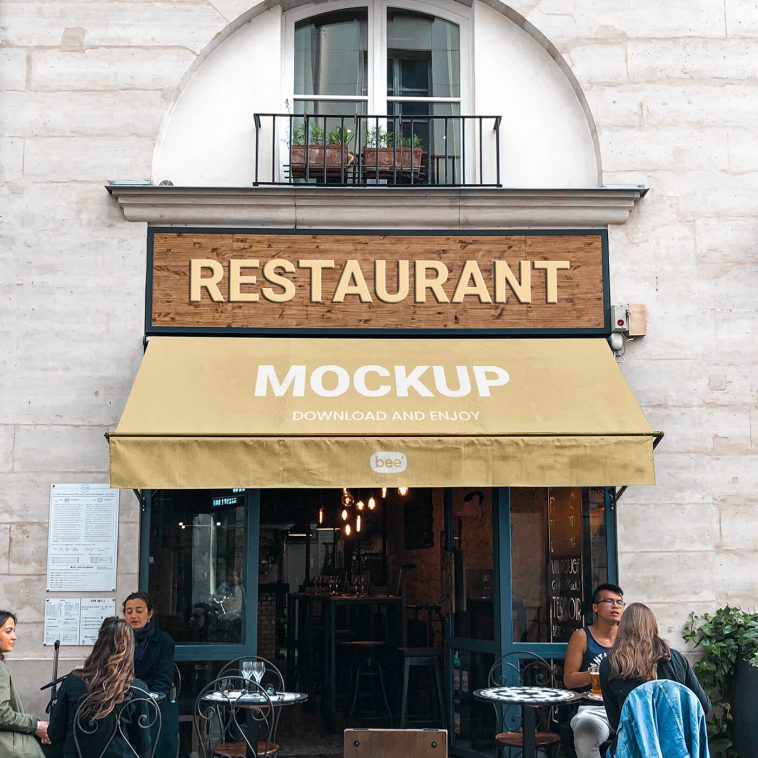
Identify the location of tables. (282, 694), (506, 694).